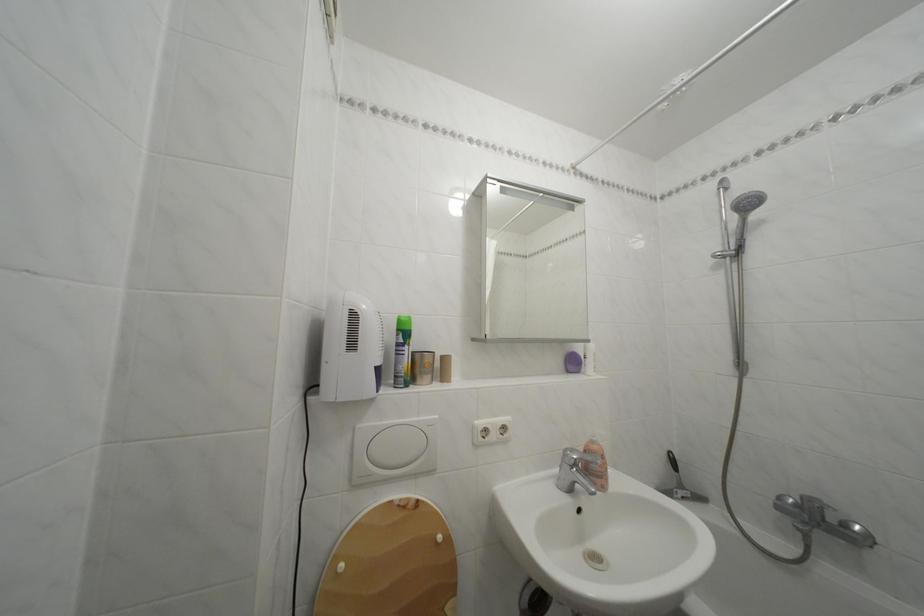
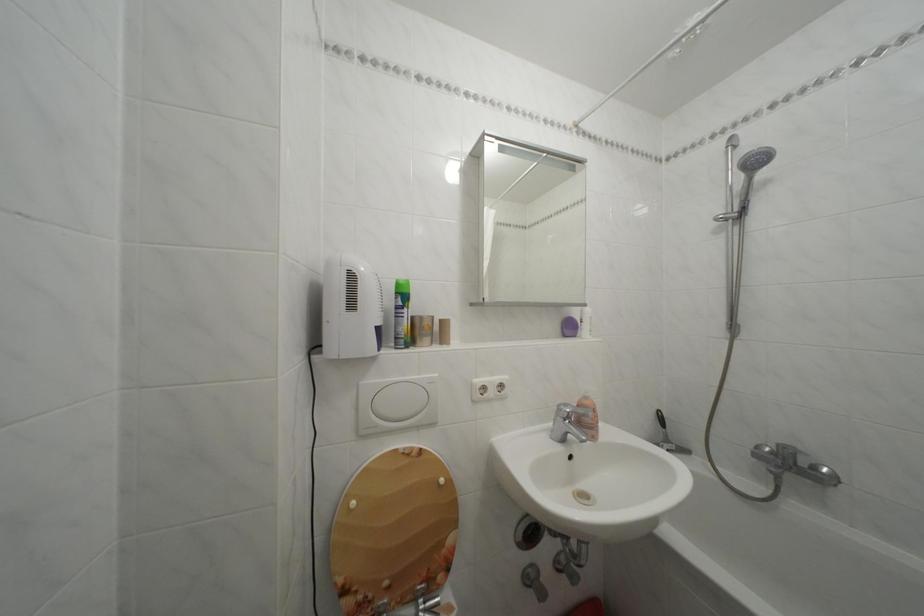
Question: How did the camera likely rotate?

Choices:
 (A) Left
 (B) Right
 (C) Up
 (D) Down

Answer: (D)